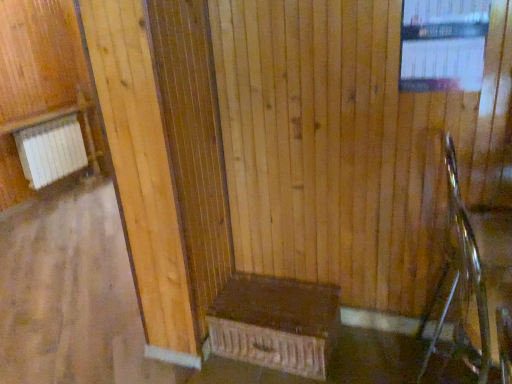
Question: Would you say transparent glass window at upper right is outside metallic silver rocking chair at right?

Choices:
 (A) no
 (B) yes

Answer: (B)

Question: Considering the relative sizes of transparent glass window at upper right and metallic silver rocking chair at right in the image provided, is transparent glass window at upper right bigger than metallic silver rocking chair at right?

Choices:
 (A) no
 (B) yes

Answer: (A)

Question: Can you confirm if transparent glass window at upper right is positioned to the left of metallic silver rocking chair at right?

Choices:
 (A) yes
 (B) no

Answer: (A)

Question: Does transparent glass window at upper right touch metallic silver rocking chair at right?

Choices:
 (A) yes
 (B) no

Answer: (B)

Question: From the image's perspective, would you say transparent glass window at upper right is shown under metallic silver rocking chair at right?

Choices:
 (A) no
 (B) yes

Answer: (A)

Question: Would you say metallic silver rocking chair at right is part of transparent glass window at upper right's contents?

Choices:
 (A) yes
 (B) no

Answer: (B)

Question: Can you confirm if dark brown wood bench at center is thinner than transparent glass window at upper right?

Choices:
 (A) yes
 (B) no

Answer: (B)

Question: Is dark brown wood bench at center placed right next to transparent glass window at upper right?

Choices:
 (A) yes
 (B) no

Answer: (B)

Question: From the image's perspective, does dark brown wood bench at center appear higher than transparent glass window at upper right?

Choices:
 (A) yes
 (B) no

Answer: (B)

Question: Could you tell me if dark brown wood bench at center is turned towards transparent glass window at upper right?

Choices:
 (A) yes
 (B) no

Answer: (B)

Question: Is the depth of dark brown wood bench at center greater than that of transparent glass window at upper right?

Choices:
 (A) yes
 (B) no

Answer: (A)

Question: Does dark brown wood bench at center appear on the left side of transparent glass window at upper right?

Choices:
 (A) yes
 (B) no

Answer: (A)

Question: Considering the relative sizes of transparent glass window at upper right and dark brown wood bench at center in the image provided, is transparent glass window at upper right smaller than dark brown wood bench at center?

Choices:
 (A) yes
 (B) no

Answer: (A)